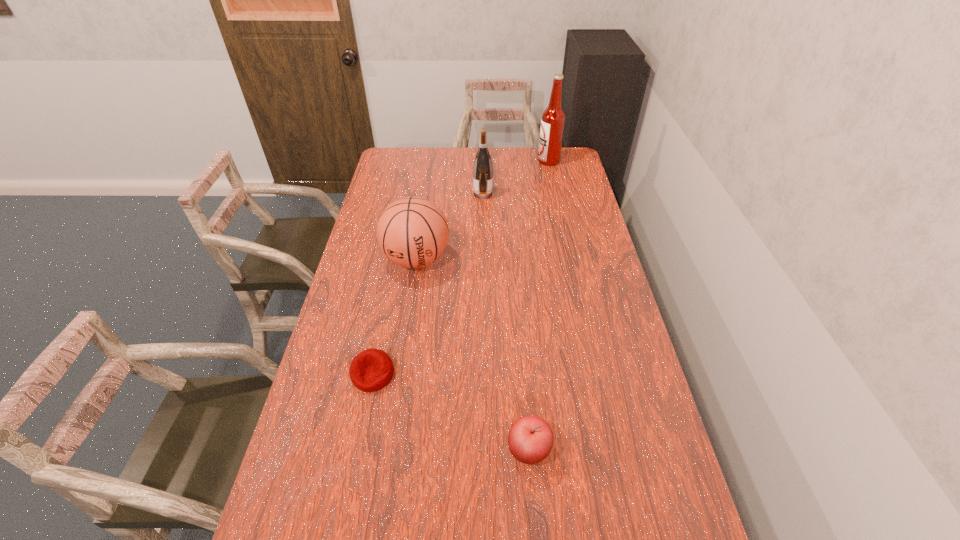
Where is `basketball located in the left edge section of the desktop`? basketball located in the left edge section of the desktop is located at coordinates (412, 232).

Find the location of a particular element. This screenshot has width=960, height=540. beanbag located at the left edge is located at coordinates (371, 370).

What are the coordinates of `object that is at the right edge` in the screenshot? It's located at (553, 118).

Where is `object that is at the far right corner`? The image size is (960, 540). object that is at the far right corner is located at coordinates (553, 118).

In the image, there is a desktop. Identify the location of blank space at the far edge. The height and width of the screenshot is (540, 960). (536, 149).

Where is `vacant space at the left edge of the desktop`? This screenshot has width=960, height=540. vacant space at the left edge of the desktop is located at coordinates (x=333, y=329).

You are a GUI agent. You are given a task and a screenshot of the screen. Output one action in this format:
    pyautogui.click(x=<x>, y=<y>)
    Task: Click on the free location at the right edge of the desktop
    The width and height of the screenshot is (960, 540).
    Given the screenshot: What is the action you would take?
    pyautogui.click(x=574, y=176)

Identify the location of unoccupied position between the fourth nearest object and the fourth farthest object. (428, 284).

Where is `free space between the wine bottle and the apple`? Image resolution: width=960 pixels, height=540 pixels. free space between the wine bottle and the apple is located at coordinates (506, 322).

At what (x,y) coordinates should I click in order to perform the action: click on free area in between the apple and the second farthest object. Please return your answer as a coordinate pair (x, y). Image resolution: width=960 pixels, height=540 pixels. Looking at the image, I should click on (506, 322).